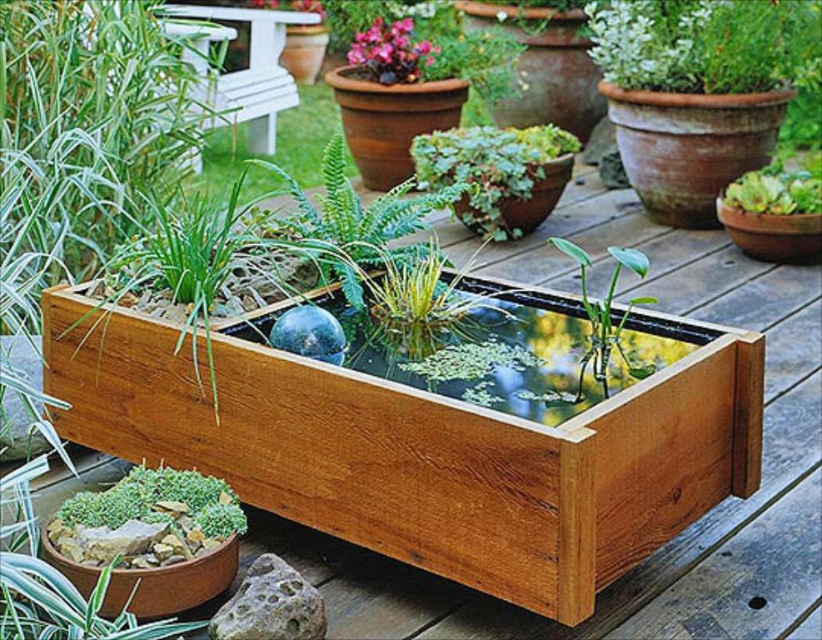
You are standing in the garden and see the wooden planter box designed as a miniature pond. There is a point at coordinates (x=497, y=349). Is this point located on the wooden fish pond at center?

Yes, the point at coordinates (x=497, y=349) is located on the wooden fish pond at center.

You are designing a garden layout and need to place both the wooden fish pond at center and the green glossy leafy plant at center. Since space is limited, which object should you prioritize placing first to ensure both fit?

The wooden fish pond at center is bigger than the green glossy leafy plant at center, so you should prioritize placing the wooden fish pond at center first to ensure there is enough space for both.

You are standing in the garden and want to place a small decorative blue stone between the two points labeled point (610, 314) and point (560, 241). Which point is closer to you so that the stone can be placed in front of it?

Point (610, 314) is further to the viewer than point (560, 241), so the point closer to you is point (560, 241). Place the stone in front of point (560, 241).